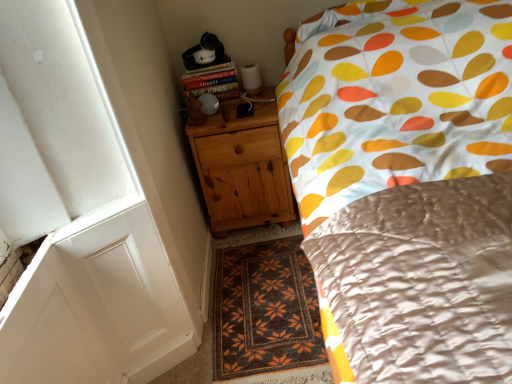
Question: Is natural wood chest of drawers at lower left bigger or smaller than hardcover book at upper left?

Choices:
 (A) big
 (B) small

Answer: (A)

Question: Considering the positions of natural wood chest of drawers at lower left and hardcover book at upper left in the image, is natural wood chest of drawers at lower left taller or shorter than hardcover book at upper left?

Choices:
 (A) short
 (B) tall

Answer: (B)

Question: Considering the real-world distances, which object is closest to the hardcover book at upper left?

Choices:
 (A) natural wood chest of drawers at lower left
 (B) brown woven rug at center

Answer: (A)

Question: Considering the real-world distances, which object is farthest from the hardcover book at upper left?

Choices:
 (A) brown woven rug at center
 (B) natural wood chest of drawers at lower left

Answer: (A)